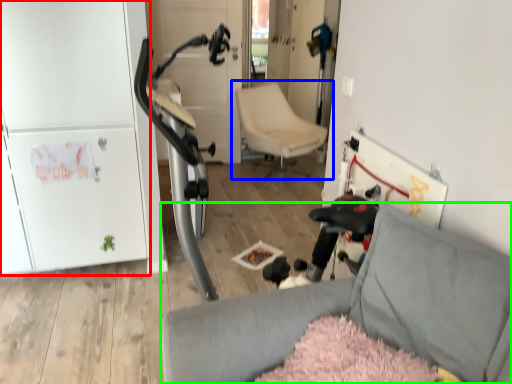
Question: Which object is the closest to the fridge (highlighted by a red box)? Choose among these: chair (highlighted by a blue box) or chair (highlighted by a green box).

Choices:
 (A) chair
 (B) chair

Answer: (B)